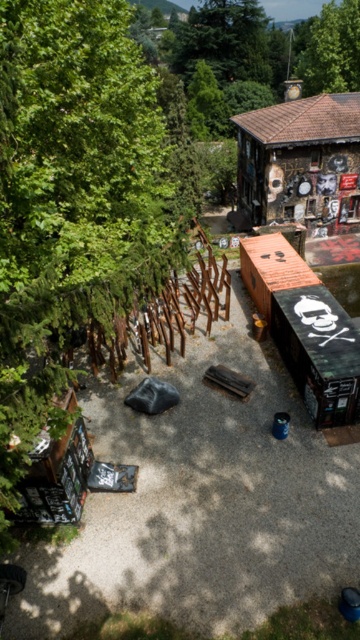
Question: Is green leafy tree at left thinner than green leafy tree at upper center?

Choices:
 (A) yes
 (B) no

Answer: (B)

Question: Which object appears closest to the camera in this image?

Choices:
 (A) green leafy tree at upper center
 (B) wooden planks at center

Answer: (B)

Question: Which point appears farthest from the camera in this image?

Choices:
 (A) (316, 51)
 (B) (5, 45)
 (C) (137, 356)
 (D) (330, 189)

Answer: (A)

Question: Can you confirm if green leafy tree at left is positioned to the right of green leafy tree at upper center?

Choices:
 (A) no
 (B) yes

Answer: (A)

Question: Does green leafy tree at left have a smaller size compared to green leafy tree at upper center?

Choices:
 (A) yes
 (B) no

Answer: (B)

Question: Among these objects, which one is nearest to the camera?

Choices:
 (A) wooden textured hut at upper right
 (B) wooden planks at center
 (C) green leafy tree at upper center
 (D) green leafy tree at left

Answer: (D)